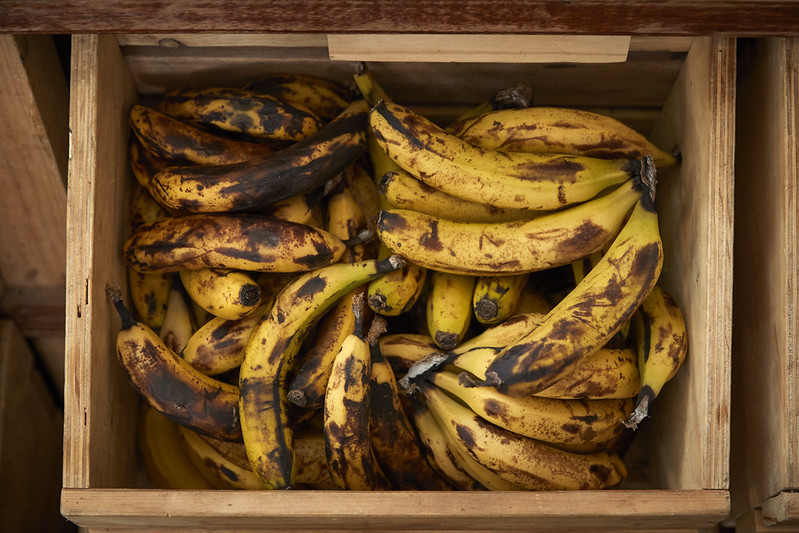
The image size is (799, 533). What are the coordinates of `rim of wooden crate` in the screenshot? It's located at (710, 232), (82, 409), (292, 508), (322, 42).